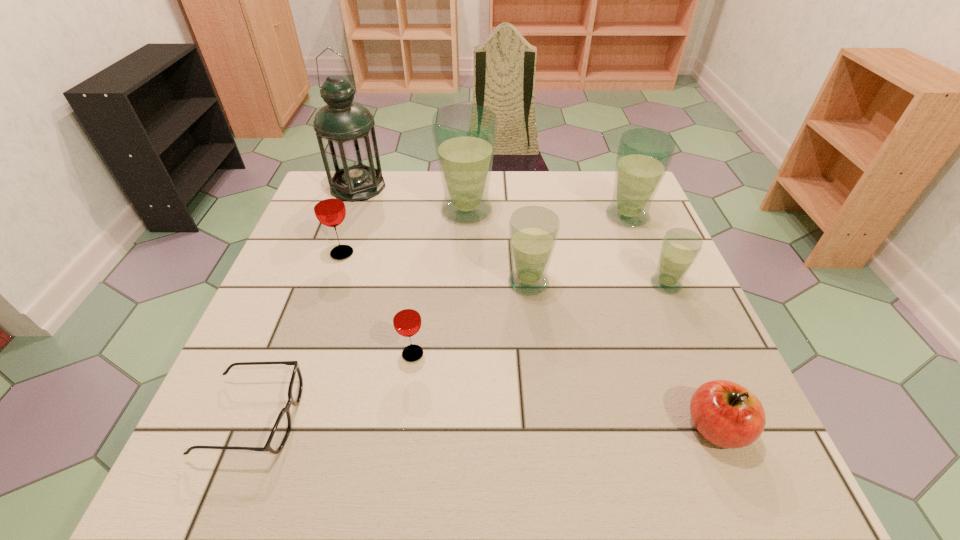
The image size is (960, 540). Find the location of `spectacles that is positioned at the left edge`. spectacles that is positioned at the left edge is located at coordinates (280, 432).

This screenshot has height=540, width=960. In order to click on apple that is at the right edge in this screenshot , I will do [x=726, y=414].

Where is `object that is at the far left corner`? This screenshot has width=960, height=540. object that is at the far left corner is located at coordinates (345, 132).

What are the coordinates of `object that is at the near left corner` in the screenshot? It's located at (280, 432).

Locate an element on the screen. object that is at the far right corner is located at coordinates (643, 156).

Image resolution: width=960 pixels, height=540 pixels. I want to click on object present at the near right corner, so click(x=726, y=414).

At what (x,y) coordinates should I click in order to perform the action: click on vacant space at the far edge. Please return your answer as a coordinate pair (x, y). This screenshot has height=540, width=960. Looking at the image, I should click on (375, 217).

Locate an element on the screen. The width and height of the screenshot is (960, 540). vacant space at the near edge of the desktop is located at coordinates (511, 492).

This screenshot has height=540, width=960. I want to click on vacant space at the left edge of the desktop, so click(x=300, y=234).

The image size is (960, 540). In the image, there is a desktop. In order to click on vacant space at the right edge in this screenshot , I will do point(632,302).